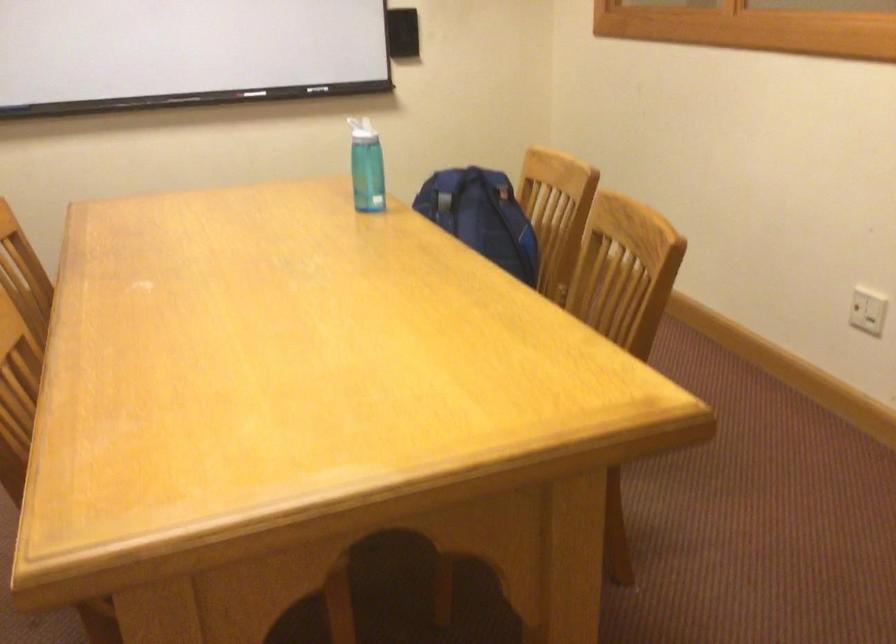
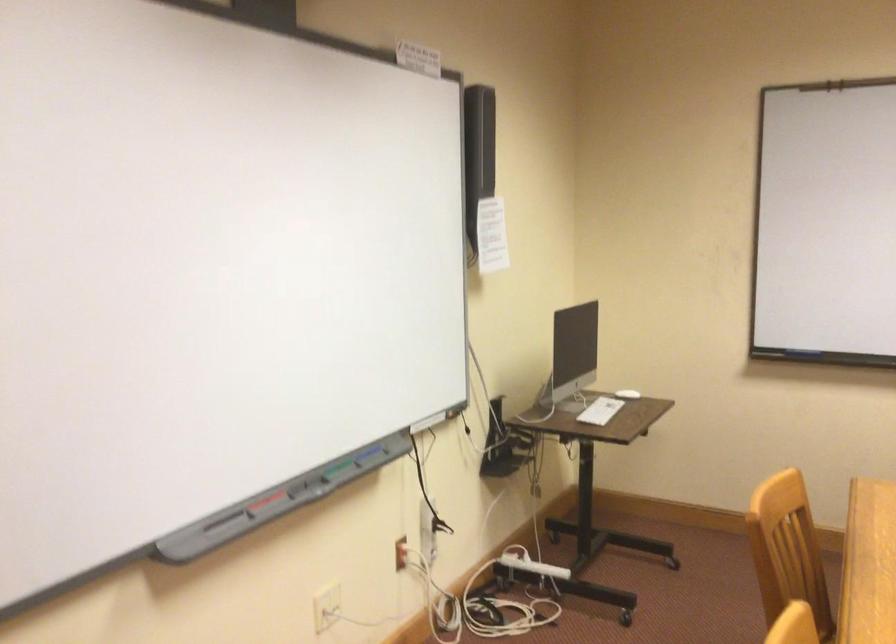
Question: The camera is either moving clockwise (left) or counter-clockwise (right) around the object. The first image is from the beginning of the video and the second image is from the end. Is the camera moving left or right when shooting the video?

Choices:
 (A) Left
 (B) Right

Answer: (B)